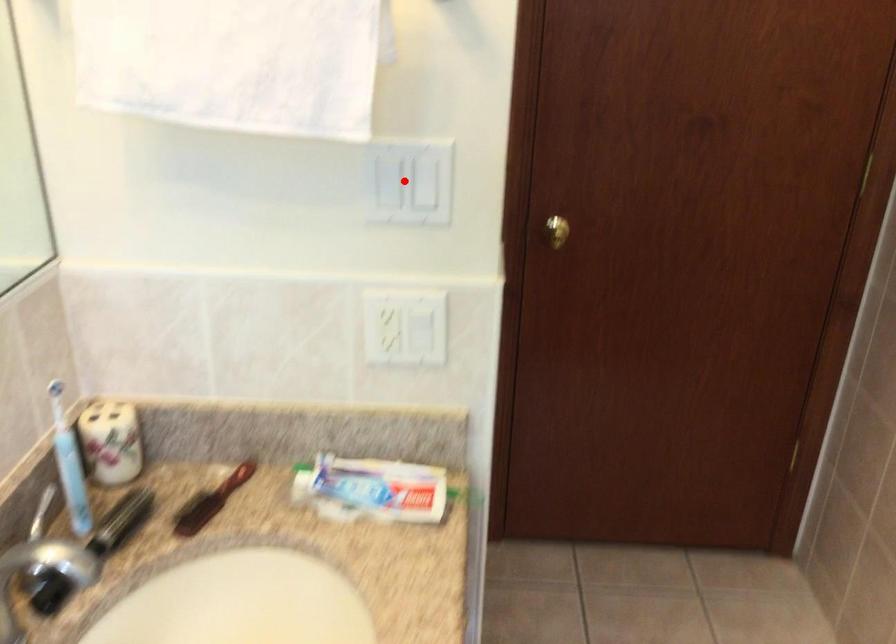
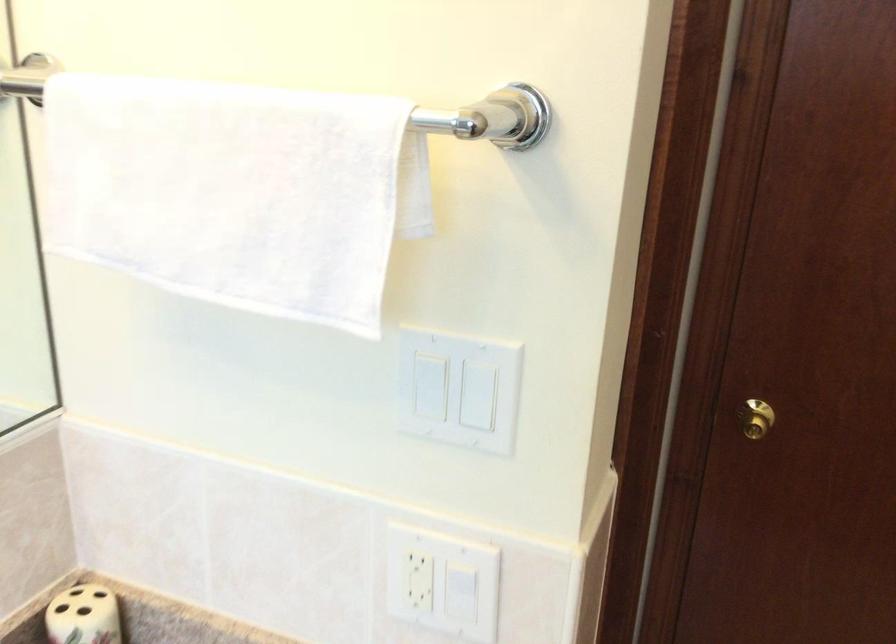
Question: A red point is marked in image1. In image2, is the corresponding 3D point closer to the camera or farther? Reply with the corresponding letter.

Choices:
 (A) The corresponding 3D point is closer.
 (B) The corresponding 3D point is farther.

Answer: (A)